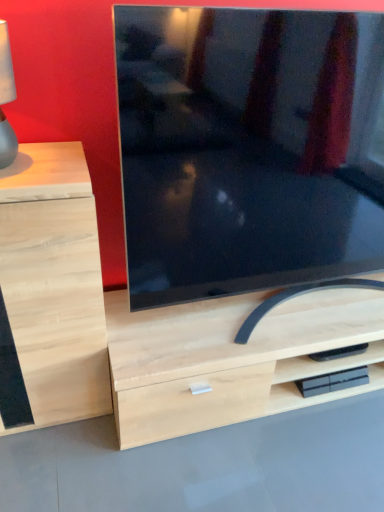
Question: From a real-world perspective, is light wood drawer at left physically above matte black tv at center?

Choices:
 (A) yes
 (B) no

Answer: (B)

Question: Is light wood drawer at left shorter than matte black tv at center?

Choices:
 (A) no
 (B) yes

Answer: (B)

Question: Considering the relative sizes of light wood drawer at left and matte black tv at center in the image provided, is light wood drawer at left taller than matte black tv at center?

Choices:
 (A) yes
 (B) no

Answer: (B)

Question: Can you confirm if light wood drawer at left is smaller than matte black tv at center?

Choices:
 (A) no
 (B) yes

Answer: (B)

Question: Considering the relative sizes of light wood drawer at left and matte black tv at center in the image provided, is light wood drawer at left bigger than matte black tv at center?

Choices:
 (A) yes
 (B) no

Answer: (B)

Question: In the image, is matte black tv at center on the left side or the right side of light wood drawer at left?

Choices:
 (A) right
 (B) left

Answer: (A)

Question: From a real-world perspective, is matte black tv at center positioned above or below light wood drawer at left?

Choices:
 (A) below
 (B) above

Answer: (B)

Question: From the image's perspective, is matte black tv at center positioned above or below light wood drawer at left?

Choices:
 (A) below
 (B) above

Answer: (B)

Question: Is point (241, 225) positioned closer to the camera than point (51, 224)?

Choices:
 (A) closer
 (B) farther

Answer: (B)

Question: Considering their positions, is matte black tv at center located in front of or behind matte gray lampshade at left?

Choices:
 (A) behind
 (B) front

Answer: (B)

Question: From their relative heights in the image, would you say matte black tv at center is taller or shorter than matte gray lampshade at left?

Choices:
 (A) short
 (B) tall

Answer: (B)

Question: From the image's perspective, is matte black tv at center above or below matte gray lampshade at left?

Choices:
 (A) below
 (B) above

Answer: (A)

Question: Do you think matte black tv at center is within matte gray lampshade at left, or outside of it?

Choices:
 (A) outside
 (B) inside

Answer: (A)

Question: From a real-world perspective, is matte gray lampshade at left positioned above or below matte black tv at center?

Choices:
 (A) below
 (B) above

Answer: (B)

Question: Considering the positions of matte gray lampshade at left and matte black tv at center in the image, is matte gray lampshade at left wider or thinner than matte black tv at center?

Choices:
 (A) thin
 (B) wide

Answer: (A)